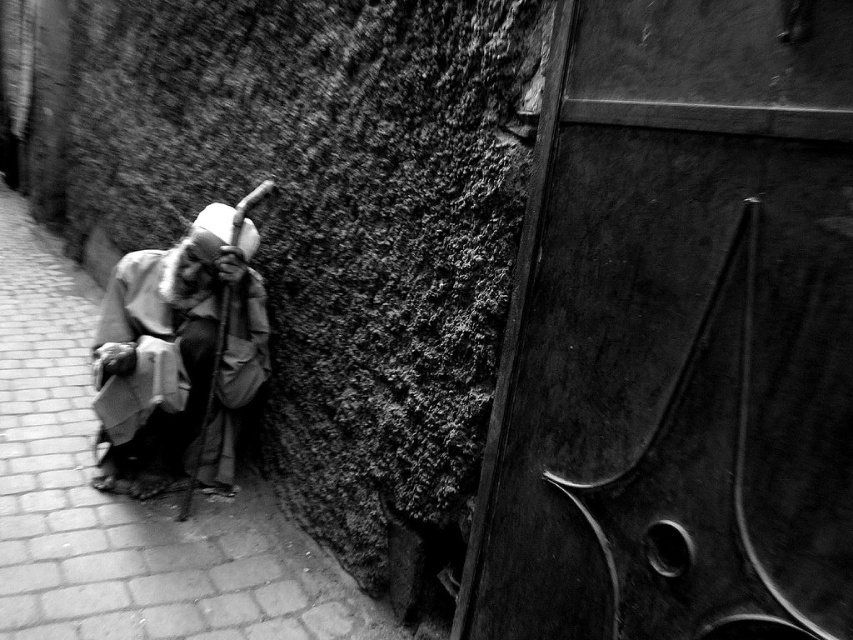
Which of these two, brick pavement at left or gray fabric cloth at left, stands taller?

With more height is brick pavement at left.

Who is positioned more to the left, brick pavement at left or gray fabric cloth at left?

brick pavement at left is more to the left.

Where is `brick pavement at left`? This screenshot has width=853, height=640. brick pavement at left is located at coordinates (128, 500).